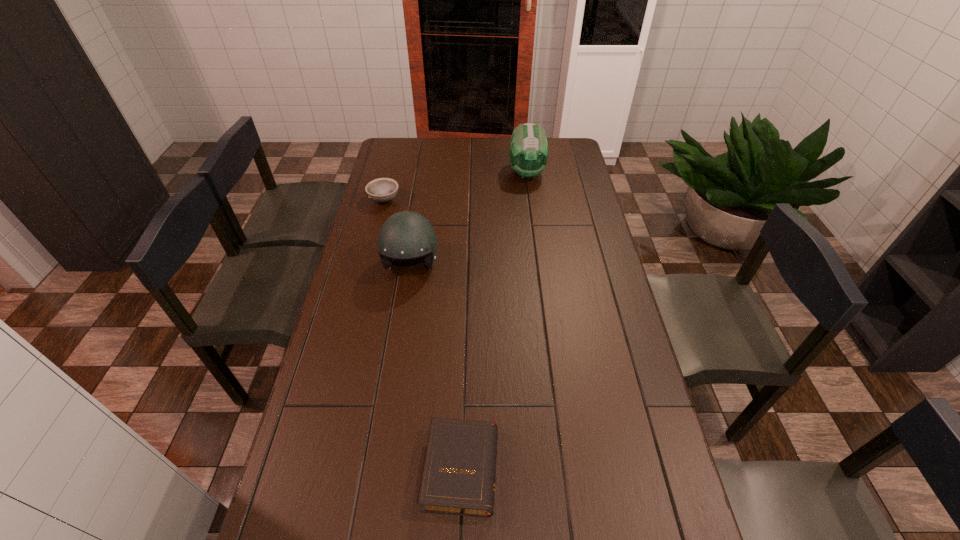
The height and width of the screenshot is (540, 960). I want to click on free space that is in between the shortest object and the nearer football helmet, so click(436, 367).

In order to click on vacant area between the third farthest object and the rightmost object in this screenshot , I will do `click(468, 219)`.

Identify the location of free spot between the nearer football helmet and the second object from right to left. (436, 367).

The width and height of the screenshot is (960, 540). What are the coordinates of `vacant space that's between the third nearest object and the farther football helmet` in the screenshot? It's located at [x=455, y=186].

The width and height of the screenshot is (960, 540). In order to click on free spot between the second object from right to left and the third nearest object in this screenshot , I will do tap(422, 334).

Locate an element on the screen. empty location between the second object from right to left and the left football helmet is located at coordinates (436, 367).

Find the location of `free space between the left football helmet and the farther football helmet`. free space between the left football helmet and the farther football helmet is located at coordinates (x=468, y=219).

I want to click on object that is the nearest to the shortest object, so click(x=405, y=235).

Identify which object is the closest to the nearer football helmet. Please provide its 2D coordinates. Your answer should be formatted as a tuple, i.e. [(x, y)], where the tuple contains the x and y coordinates of a point satisfying the conditions above.

[(381, 190)]

This screenshot has width=960, height=540. In order to click on free space that satisfies the following two spatial constraints: 1. at the face opening of the nearer football helmet; 2. on the left side of the shortest object in this screenshot , I will do `click(379, 468)`.